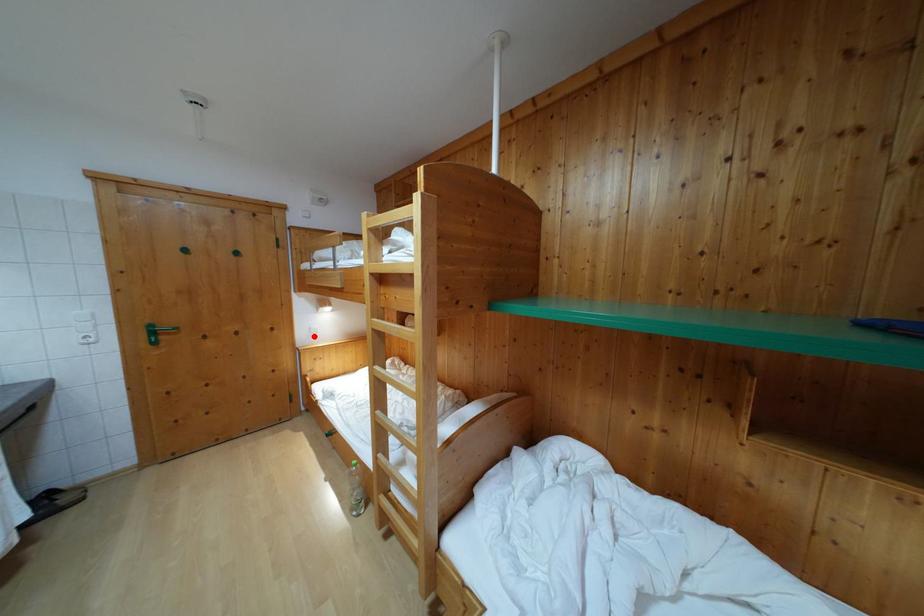
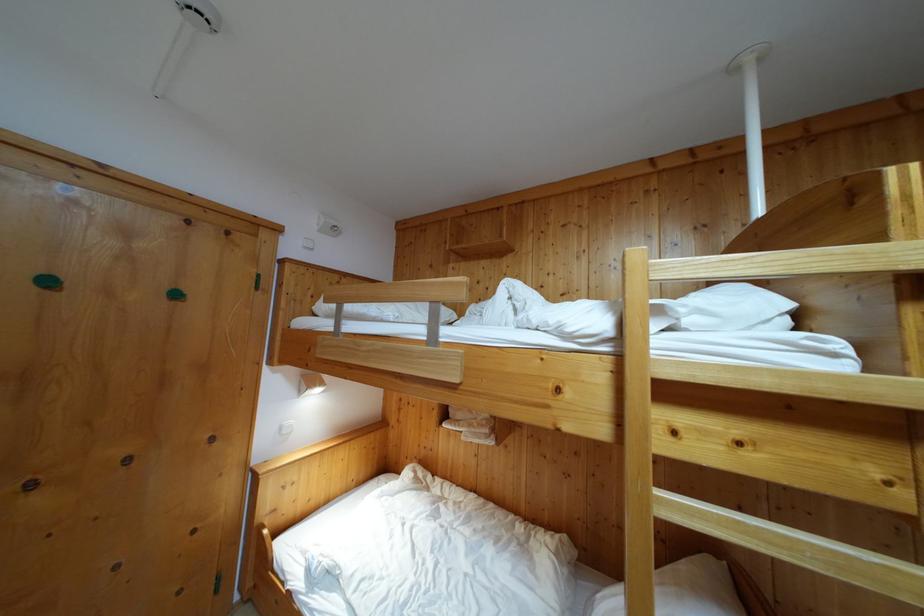
Locate, in the second image, the point that corresponds to the highlighted location in the first image.

(285, 435)